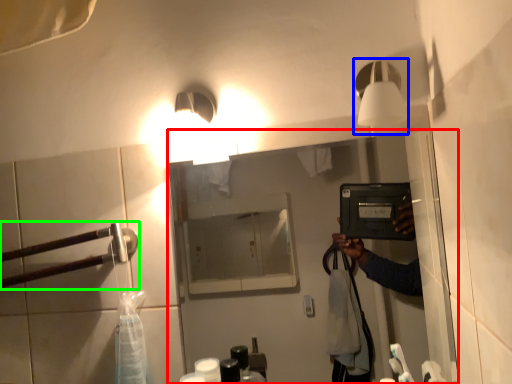
Question: Based on their relative distances, which object is nearer to mirror (highlighted by a red box)? Choose from light fixture (highlighted by a blue box) and door handle (highlighted by a green box).

Choices:
 (A) light fixture
 (B) door handle

Answer: (B)